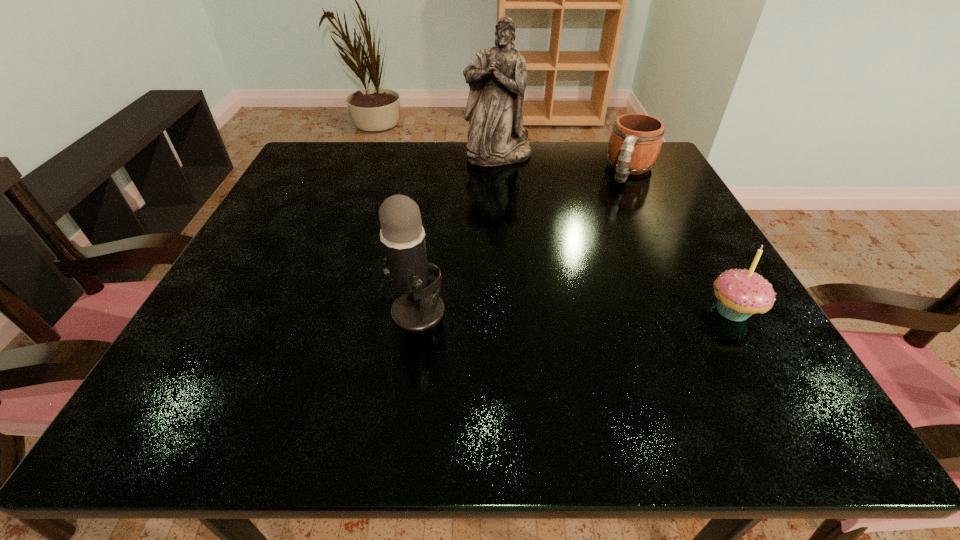
Locate an element on the screen. This screenshot has height=540, width=960. the leftmost object is located at coordinates (402, 235).

Locate an element on the screen. microphone is located at coordinates (402, 235).

Identify the location of cupcake. (740, 293).

Where is `the tallest object`? This screenshot has height=540, width=960. the tallest object is located at coordinates (497, 80).

You are a GUI agent. You are given a task and a screenshot of the screen. Output one action in this format:
    pyautogui.click(x=<x>, y=<y>)
    Task: Click on the figurine
    The width and height of the screenshot is (960, 540).
    Given the screenshot: What is the action you would take?
    pyautogui.click(x=497, y=80)

The width and height of the screenshot is (960, 540). What are the coordinates of `mug` in the screenshot? It's located at (636, 139).

Locate an element on the screen. Image resolution: width=960 pixels, height=540 pixels. free location located 0.210m on the back of the microphone is located at coordinates (431, 220).

The height and width of the screenshot is (540, 960). Find the location of `free space located on the front of the cupcake`. free space located on the front of the cupcake is located at coordinates (765, 368).

This screenshot has width=960, height=540. What are the coordinates of `blank space located 0.280m on the front-facing side of the figurine` in the screenshot? It's located at (523, 237).

At what (x,y) coordinates should I click in order to perform the action: click on vacant space located on the front-facing side of the figurine. Please return your answer as a coordinate pair (x, y). This screenshot has width=960, height=540. Looking at the image, I should click on (535, 275).